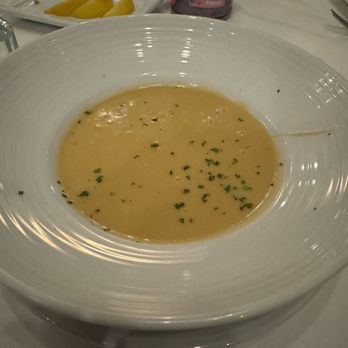
The image size is (348, 348). What are the coordinates of `dish` in the screenshot? It's located at (142, 221).